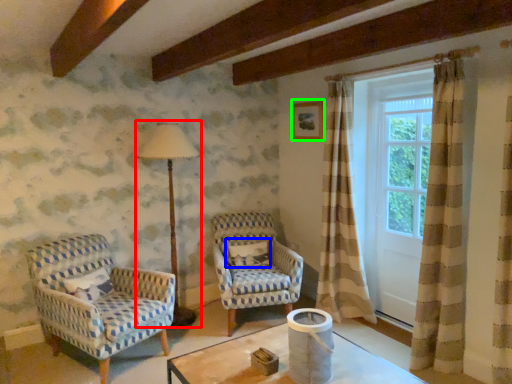
Question: Which is nearer to the table lamp (highlighted by a red box)? pillow (highlighted by a blue box) or picture frame (highlighted by a green box).

Choices:
 (A) pillow
 (B) picture frame

Answer: (A)